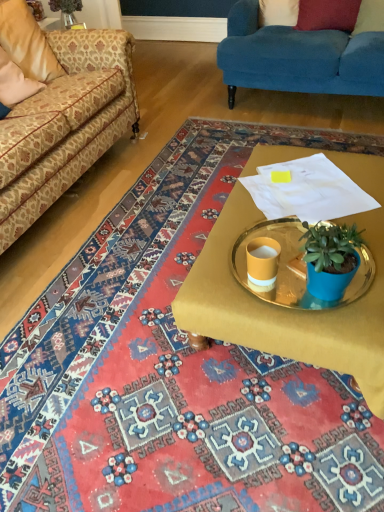
Question: Does beige fabric pillow at upper left, which is counted as the fourth pillow, starting from the right, have a lesser height compared to velvet blue couch at upper right, which appears as the 1th studio couch when viewed from the right?

Choices:
 (A) no
 (B) yes

Answer: (B)

Question: Does beige fabric pillow at upper left, which is the 1th pillow in left-to-right order, have a smaller size compared to velvet blue couch at upper right, which appears as the 1th studio couch when viewed from the right?

Choices:
 (A) no
 (B) yes

Answer: (B)

Question: From the image's perspective, is beige fabric pillow at upper left, which is the 1th pillow in left-to-right order, on top of velvet blue couch at upper right, which appears as the 1th studio couch when viewed from the right?

Choices:
 (A) yes
 (B) no

Answer: (B)

Question: Are beige fabric pillow at upper left, which is the 1th pillow in left-to-right order, and velvet blue couch at upper right, which appears as the 2th studio couch when viewed from the left, beside each other?

Choices:
 (A) no
 (B) yes

Answer: (A)

Question: Can velvet blue couch at upper right, which appears as the 2th studio couch when viewed from the left, be found inside beige fabric pillow at upper left, which is the 1th pillow in left-to-right order?

Choices:
 (A) no
 (B) yes

Answer: (A)

Question: Looking at the image, does matte yellow cup at center seem bigger or smaller compared to white fabric pillow at upper center, positioned as the third pillow in right-to-left order?

Choices:
 (A) big
 (B) small

Answer: (B)

Question: From their relative heights in the image, would you say matte yellow cup at center is taller or shorter than white fabric pillow at upper center, marked as the 2th pillow in a left-to-right arrangement?

Choices:
 (A) tall
 (B) short

Answer: (B)

Question: From the image's perspective, relative to white fabric pillow at upper center, positioned as the third pillow in right-to-left order, is matte yellow cup at center above or below?

Choices:
 (A) below
 (B) above

Answer: (A)

Question: Considering the positions of matte yellow cup at center and white fabric pillow at upper center, positioned as the third pillow in right-to-left order, in the image, is matte yellow cup at center wider or thinner than white fabric pillow at upper center, positioned as the third pillow in right-to-left order,?

Choices:
 (A) thin
 (B) wide

Answer: (A)

Question: Relative to velvet blue couch at upper right, which appears as the 1th studio couch when viewed from the right, is white fabric pillow at upper center, positioned as the third pillow in right-to-left order, in front or behind?

Choices:
 (A) front
 (B) behind

Answer: (B)

Question: From a real-world perspective, is white fabric pillow at upper center, positioned as the third pillow in right-to-left order, physically located above or below velvet blue couch at upper right, which appears as the 2th studio couch when viewed from the left?

Choices:
 (A) above
 (B) below

Answer: (A)

Question: Visually, is white fabric pillow at upper center, positioned as the third pillow in right-to-left order, positioned to the left or to the right of velvet blue couch at upper right, which appears as the 1th studio couch when viewed from the right?

Choices:
 (A) right
 (B) left

Answer: (B)

Question: From the image's perspective, relative to velvet blue couch at upper right, which appears as the 1th studio couch when viewed from the right, is white fabric pillow at upper center, marked as the 2th pillow in a left-to-right arrangement, above or below?

Choices:
 (A) below
 (B) above

Answer: (B)

Question: Considering the positions of point (329, 307) and point (355, 25), is point (329, 307) closer or farther from the camera than point (355, 25)?

Choices:
 (A) farther
 (B) closer

Answer: (B)

Question: In terms of width, does gold metallic tray at center look wider or thinner when compared to velvet red pillow at upper right, which is counted as the first pillow, starting from the right?

Choices:
 (A) wide
 (B) thin

Answer: (A)